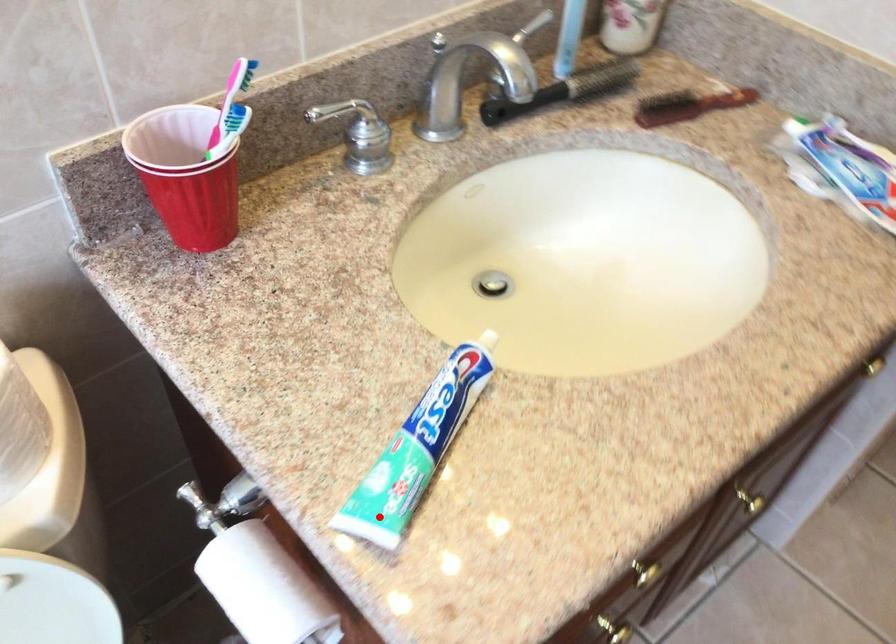
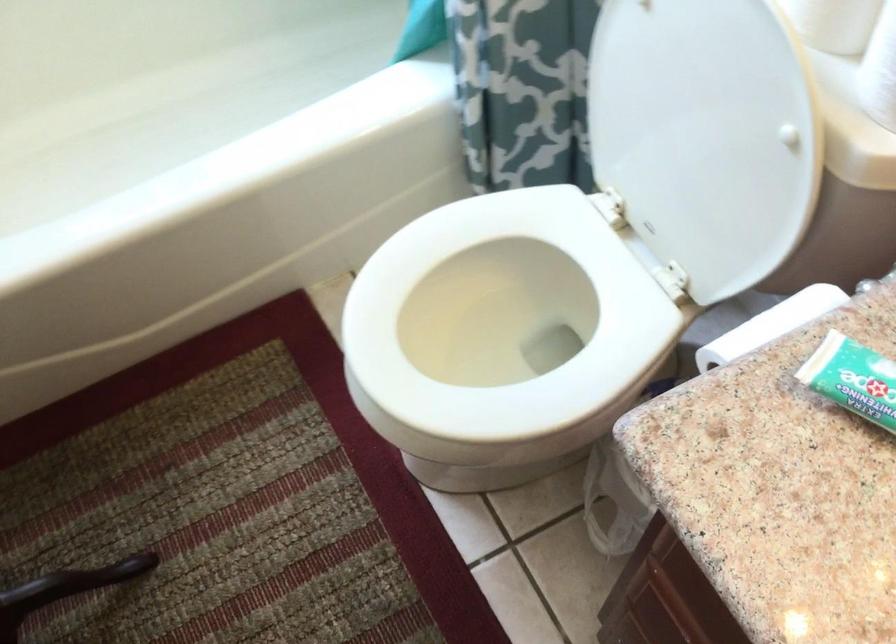
Question: A red point is marked in image1. In image2, is the corresponding 3D point closer to the camera or farther? Reply with the corresponding letter.

Choices:
 (A) The corresponding 3D point is closer.
 (B) The corresponding 3D point is farther.

Answer: (A)